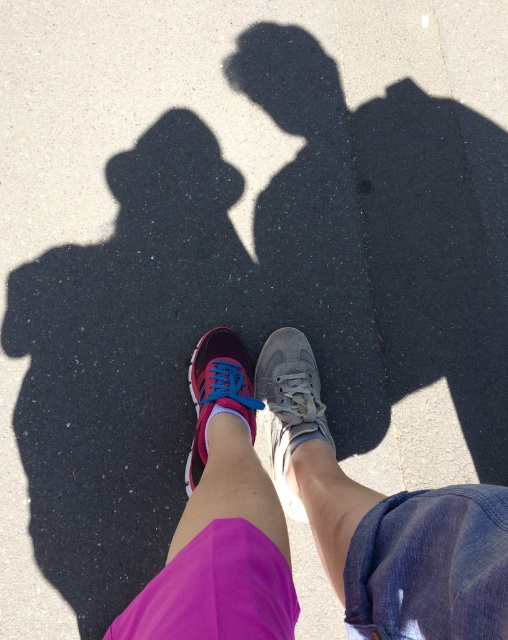
Question: Does pink fabric shorts at lower center have a greater width compared to gray fabric sneaker at center?

Choices:
 (A) yes
 (B) no

Answer: (A)

Question: Considering the relative positions of pink fabric shorts at lower center and shiny pink running shoe at center in the image provided, where is pink fabric shorts at lower center located with respect to shiny pink running shoe at center?

Choices:
 (A) above
 (B) below

Answer: (B)

Question: Which object appears farthest from the camera in this image?

Choices:
 (A) gray fabric sneaker at center
 (B) pink fabric shorts at lower center
 (C) shiny pink running shoe at center

Answer: (A)

Question: Does pink fabric shorts at lower center appear on the right side of shiny pink running shoe at center?

Choices:
 (A) no
 (B) yes

Answer: (B)

Question: Among these points, which one is nearest to the camera?

Choices:
 (A) (362, 570)
 (B) (283, 330)

Answer: (A)

Question: Which point is closer to the camera taking this photo?

Choices:
 (A) (195, 362)
 (B) (228, 442)

Answer: (B)